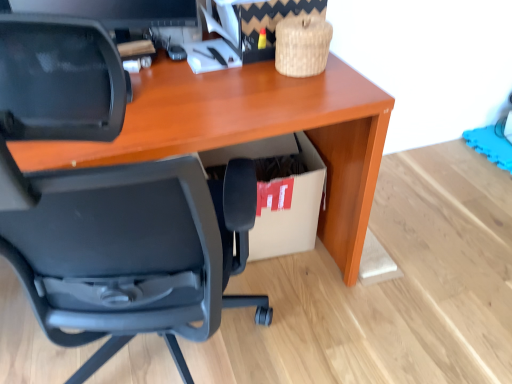
At what (x,y) coordinates should I click in order to perform the action: click on black plastic chair at lower left. Please return your answer as a coordinate pair (x, y). Looking at the image, I should click on (110, 205).

This screenshot has width=512, height=384. What do you see at coordinates (110, 205) in the screenshot? I see `black plastic chair at lower left` at bounding box center [110, 205].

The image size is (512, 384). Find the location of `cardboard box at lower right`. cardboard box at lower right is located at coordinates (281, 195).

What do you see at coordinates (281, 195) in the screenshot? The width and height of the screenshot is (512, 384). I see `cardboard box at lower right` at bounding box center [281, 195].

The width and height of the screenshot is (512, 384). What are the coordinates of `black plastic chair at lower left` in the screenshot? It's located at (110, 205).

Can you confirm if black plastic chair at lower left is positioned to the left of cardboard box at lower right?

Yes, black plastic chair at lower left is to the left of cardboard box at lower right.

Which is behind, black plastic chair at lower left or cardboard box at lower right?

cardboard box at lower right is further away from the camera.

Does point (72, 254) come behind point (317, 168)?

No, it is not.

From the image's perspective, is black plastic chair at lower left on top of cardboard box at lower right?

No, from the image's perspective, black plastic chair at lower left is not above cardboard box at lower right.

From a real-world perspective, who is located lower, black plastic chair at lower left or cardboard box at lower right?

From a 3D spatial view, cardboard box at lower right is below.

Looking at their sizes, would you say black plastic chair at lower left is wider or thinner than cardboard box at lower right?

Considering their sizes, black plastic chair at lower left looks broader than cardboard box at lower right.

Based on the photo, can you confirm if black plastic chair at lower left is shorter than cardboard box at lower right?

In fact, black plastic chair at lower left may be taller than cardboard box at lower right.

Considering the sizes of objects black plastic chair at lower left and cardboard box at lower right in the image provided, who is smaller, black plastic chair at lower left or cardboard box at lower right?

cardboard box at lower right.

Choose the correct answer: Is black plastic chair at lower left inside cardboard box at lower right or outside it?

black plastic chair at lower left cannot be found inside cardboard box at lower right.

Would you consider black plastic chair at lower left to be distant from cardboard box at lower right?

No, black plastic chair at lower left is in close proximity to cardboard box at lower right.

Could you tell me if black plastic chair at lower left is turned towards cardboard box at lower right?

Yes, black plastic chair at lower left is oriented towards cardboard box at lower right.

Can you tell me how much black plastic chair at lower left and cardboard box at lower right differ in facing direction?

There is a 170-degree angle between the facing directions of black plastic chair at lower left and cardboard box at lower right.

Identify the location of cardboard box below the black plastic chair at lower left (from a real-world perspective). The width and height of the screenshot is (512, 384). (281, 195).

Considering the relative positions of cardboard box at lower right and black plastic chair at lower left in the image provided, is cardboard box at lower right to the right of black plastic chair at lower left from the viewer's perspective?

Indeed, cardboard box at lower right is positioned on the right side of black plastic chair at lower left.

In the scene shown: Does cardboard box at lower right come in front of black plastic chair at lower left?

No, cardboard box at lower right is behind black plastic chair at lower left.

Is point (311, 181) positioned before point (216, 220)?

No, (311, 181) is behind (216, 220).

From the image's perspective, which is above, cardboard box at lower right or black plastic chair at lower left?

cardboard box at lower right is shown above in the image.

From a real-world perspective, relative to black plastic chair at lower left, is cardboard box at lower right vertically above or below?

cardboard box at lower right is situated lower than black plastic chair at lower left in the real world.

Between cardboard box at lower right and black plastic chair at lower left, which one has smaller width?

cardboard box at lower right.

From their relative heights in the image, would you say cardboard box at lower right is taller or shorter than black plastic chair at lower left?

Clearly, cardboard box at lower right is shorter compared to black plastic chair at lower left.

Does cardboard box at lower right have a larger size compared to black plastic chair at lower left?

No.

Is cardboard box at lower right located outside black plastic chair at lower left?

Indeed, cardboard box at lower right is completely outside black plastic chair at lower left.

Is the surface of cardboard box at lower right in direct contact with black plastic chair at lower left?

cardboard box at lower right and black plastic chair at lower left are clearly separated.

Is cardboard box at lower right oriented away from black plastic chair at lower left?

No, cardboard box at lower right's orientation is not away from black plastic chair at lower left.

Can you tell me how much cardboard box at lower right and black plastic chair at lower left differ in facing direction?

170 degrees separate the facing orientations of cardboard box at lower right and black plastic chair at lower left.

How much distance is there between cardboard box at lower right and black plastic chair at lower left?

cardboard box at lower right and black plastic chair at lower left are 22.96 inches apart.

The width and height of the screenshot is (512, 384). I want to click on cardboard box that is on the right side of black plastic chair at lower left, so click(x=281, y=195).

Where is `chair that is in front of the cardboard box at lower right`? The image size is (512, 384). chair that is in front of the cardboard box at lower right is located at coordinates (110, 205).

The image size is (512, 384). What are the coordinates of `cardboard box behind the black plastic chair at lower left` in the screenshot? It's located at (281, 195).